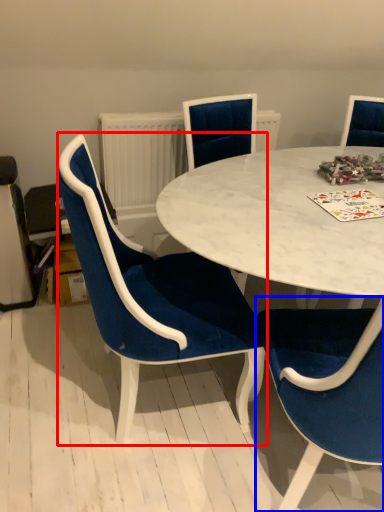
Question: Which object appears closest to the camera in this image, chair (highlighted by a red box) or chair (highlighted by a blue box)?

Choices:
 (A) chair
 (B) chair

Answer: (B)